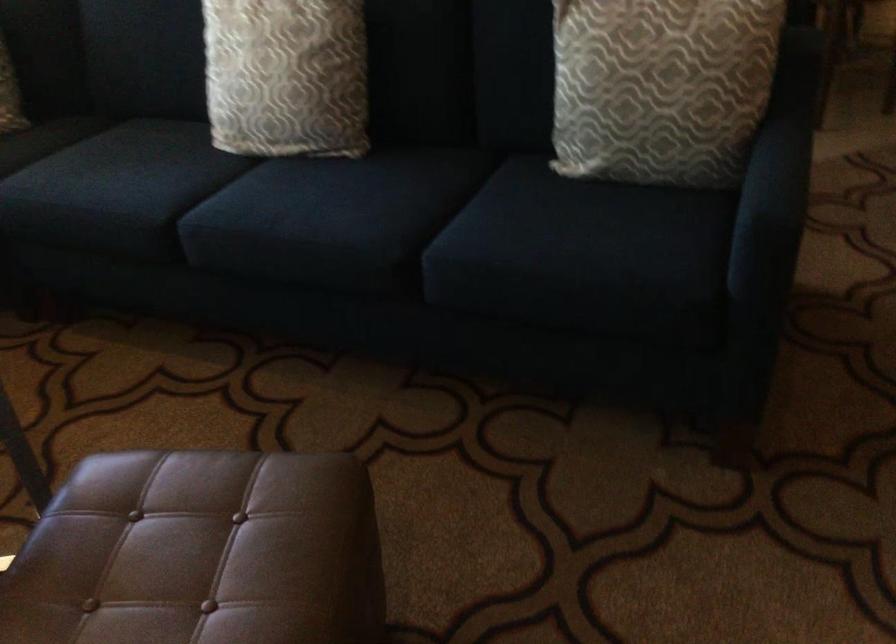
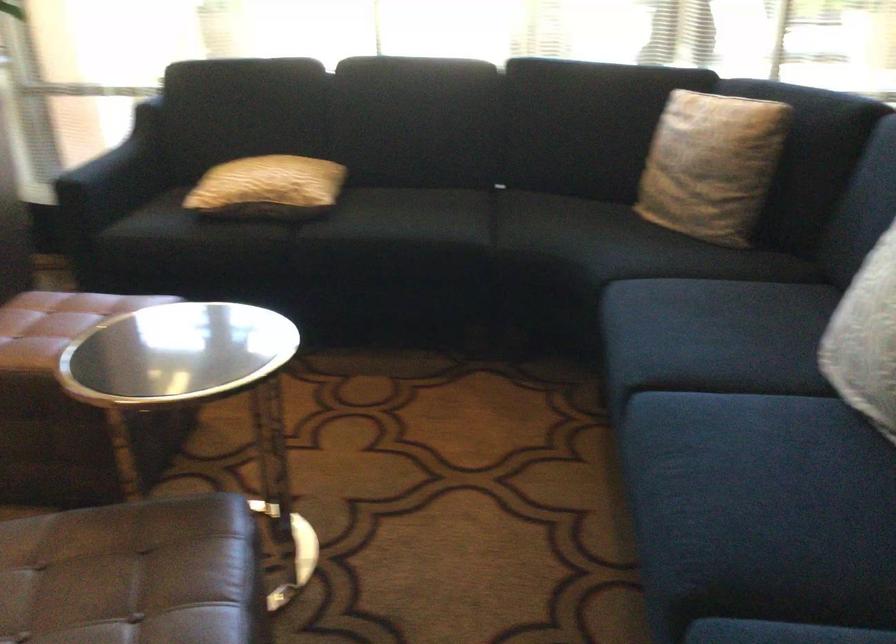
Where in the second image is the point corresponding to point 186,527 from the first image?

(134, 574)